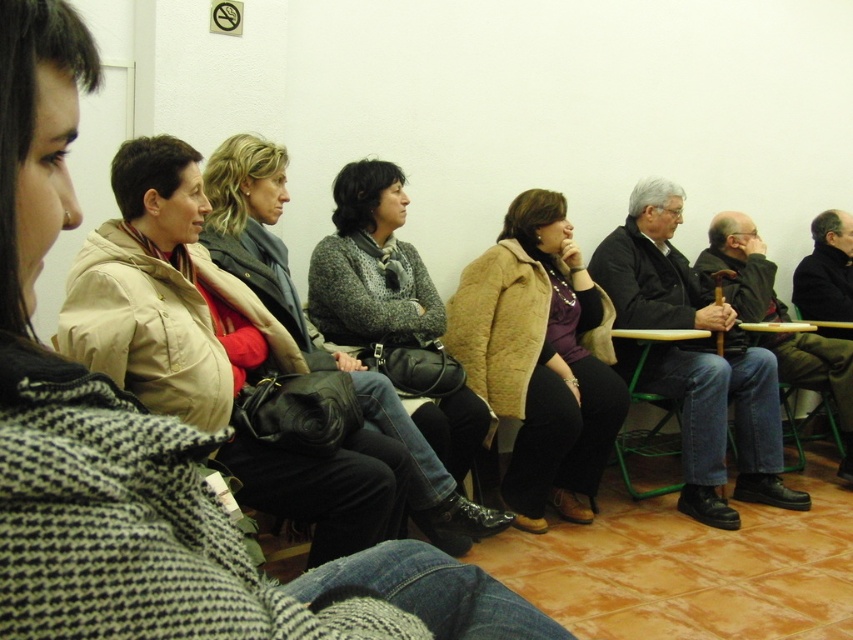
At what (x,y) coordinates should I click in order to perform the action: click on beige fuzzy coat at center. Please return your answer as a coordinate pair (x, y). Looking at the image, I should click on (540, 358).

Who is lower down, beige fuzzy coat at center or gray knit sweater at center?

beige fuzzy coat at center is lower down.

The width and height of the screenshot is (853, 640). What do you see at coordinates (540, 358) in the screenshot? I see `beige fuzzy coat at center` at bounding box center [540, 358].

The height and width of the screenshot is (640, 853). I want to click on beige fuzzy coat at center, so click(x=540, y=358).

Does beige fabric coat at upper left have a greater width compared to dark gray sweater at center?

No.

Is point (276, 470) less distant than point (717, 515)?

Yes, it is in front of point (717, 515).

Is point (135, 193) in front of point (764, 348)?

Yes, it is.

Where is `beige fabric coat at upper left`? Image resolution: width=853 pixels, height=640 pixels. beige fabric coat at upper left is located at coordinates (165, 294).

Is dark gray sweater at center closer to camera compared to gray knit sweater at center?

No, dark gray sweater at center is behind gray knit sweater at center.

From the picture: Does dark gray sweater at center appear over gray knit sweater at center?

No, dark gray sweater at center is not above gray knit sweater at center.

Does point (766, 429) lie behind point (334, 184)?

Yes.

Find the location of a particular element. This screenshot has height=640, width=853. dark gray sweater at center is located at coordinates (695, 362).